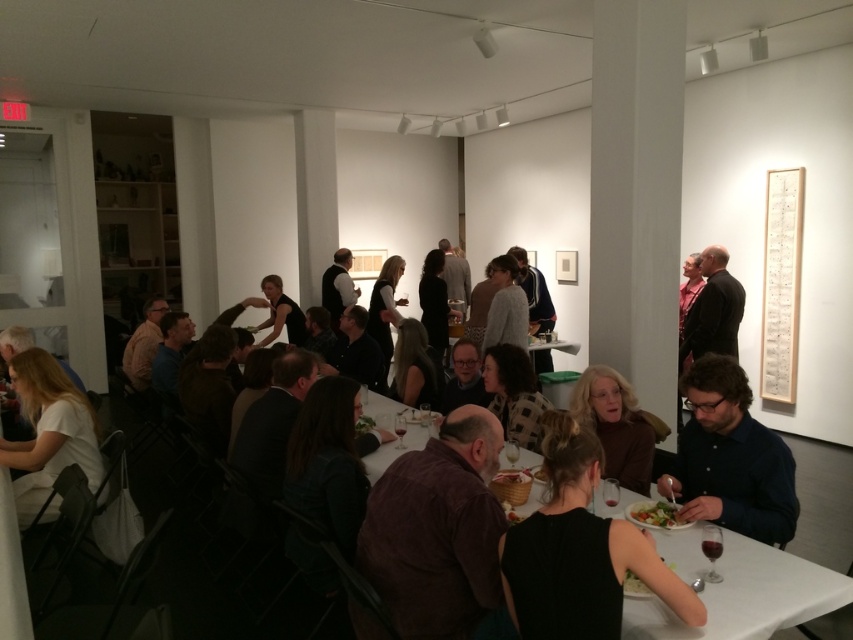
Is black fabric dress at lower center shorter than white matte shirt at lower left?

Yes.

Can you confirm if black fabric dress at lower center is smaller than white matte shirt at lower left?

Correct, black fabric dress at lower center occupies less space than white matte shirt at lower left.

The width and height of the screenshot is (853, 640). I want to click on black fabric dress at lower center, so click(x=579, y=550).

The height and width of the screenshot is (640, 853). I want to click on black fabric dress at lower center, so click(579, 550).

Between dark brown textured shirt at center and black fabric dress at lower center, which one appears on the left side from the viewer's perspective?

dark brown textured shirt at center

This screenshot has height=640, width=853. What do you see at coordinates (437, 531) in the screenshot?
I see `dark brown textured shirt at center` at bounding box center [437, 531].

Image resolution: width=853 pixels, height=640 pixels. What do you see at coordinates (437, 531) in the screenshot?
I see `dark brown textured shirt at center` at bounding box center [437, 531].

Identify the location of dark brown textured shirt at center. Image resolution: width=853 pixels, height=640 pixels. (437, 531).

Who is positioned more to the right, black matte shirt at center or green leafy salad at lower center?

Positioned to the right is green leafy salad at lower center.

Is point (263, 280) farther from camera compared to point (668, 518)?

Yes.

This screenshot has width=853, height=640. Describe the element at coordinates (280, 314) in the screenshot. I see `black matte shirt at center` at that location.

Identify the location of black matte shirt at center. (280, 314).